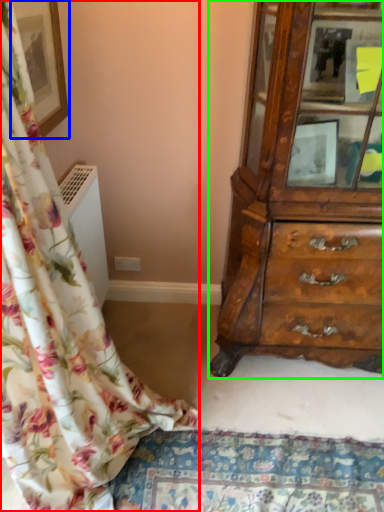
Question: Which object is the closest to the curtain (highlighted by a red box)? Choose among these: picture frame (highlighted by a blue box) or chest of drawers (highlighted by a green box).

Choices:
 (A) picture frame
 (B) chest of drawers

Answer: (A)